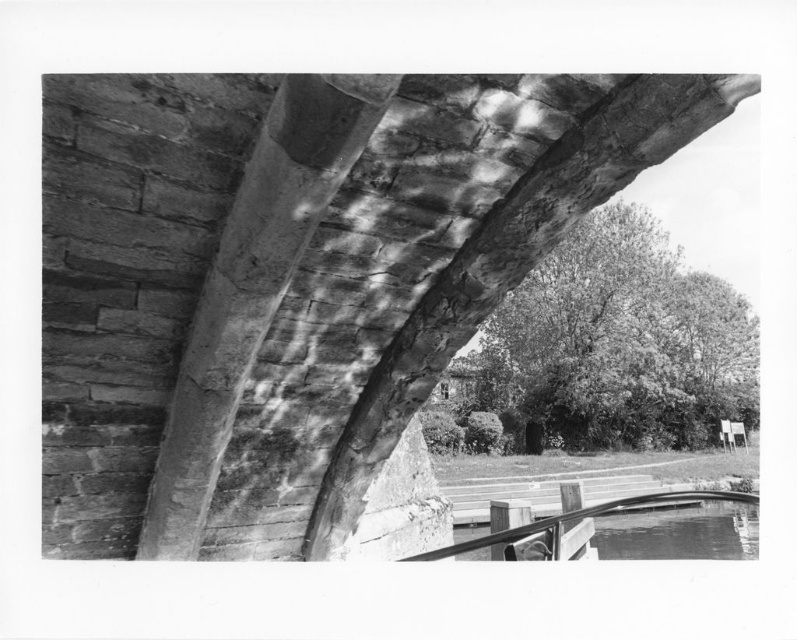
Question: Which object appears farthest from the camera in this image?

Choices:
 (A) rough stone beam at center
 (B) stone textured bridge at upper center

Answer: (B)

Question: Can you confirm if stone textured bridge at upper center is positioned above rough stone beam at center?

Choices:
 (A) yes
 (B) no

Answer: (B)

Question: Does stone textured bridge at upper center have a larger size compared to rough stone beam at center?

Choices:
 (A) yes
 (B) no

Answer: (A)

Question: Is stone textured bridge at upper center to the left of rough stone beam at center from the viewer's perspective?

Choices:
 (A) no
 (B) yes

Answer: (A)

Question: Which point is closer to the camera taking this photo?

Choices:
 (A) (96, 90)
 (B) (273, 472)

Answer: (A)